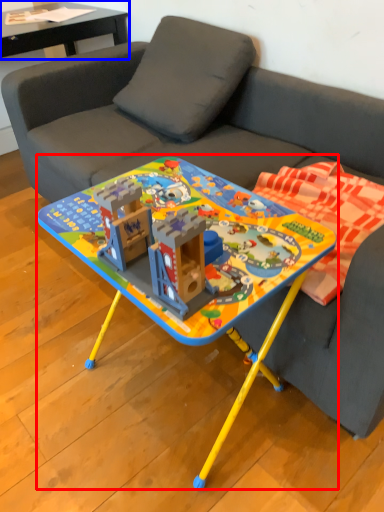
Question: Among these objects, which one is farthest to the camera, table (highlighted by a red box) or table (highlighted by a blue box)?

Choices:
 (A) table
 (B) table

Answer: (B)